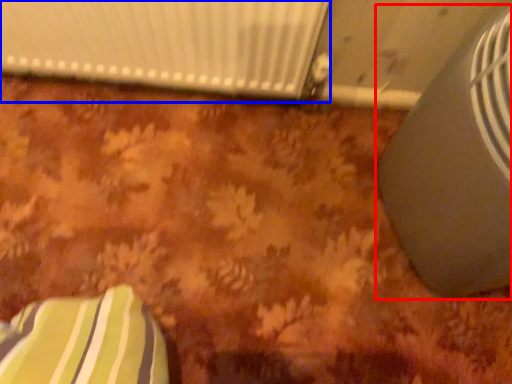
Question: Which object appears farthest to the camera in this image, air conditioning (highlighted by a red box) or radiator (highlighted by a blue box)?

Choices:
 (A) air conditioning
 (B) radiator

Answer: (B)